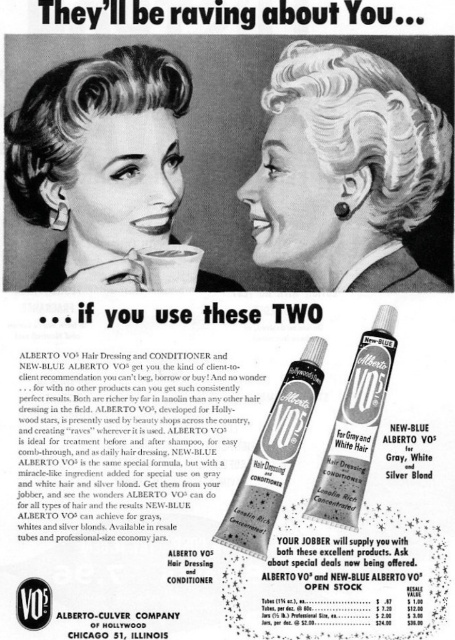
You are a hair stylist observing this vintage advertisement. You need to place a small decorative ribbon between the sleek blonde hair at center and the silver metallic hair conditioner at center. Given that the ribbon is 12 inches long, will there be enough space to place it between them without overlapping either object?

The distance between the sleek blonde hair at center and the silver metallic hair conditioner at center is 21.63 inches. Since the ribbon is only 12 inches long, there is sufficient space to place it between them without overlapping either object.

You are standing 1 meter away from the advertisement. There is a point at coordinates point (439,186). Can you reach that point without moving closer to the advertisement?

The distance of point (439,186) is 1.16 meters from the viewer, so you are currently 1 meter away. Since 1.16 meters is farther than 1 meter, you cannot reach that point without moving closer to the advertisement.

You are a stylist analyzing the vintage advertisement. You notice the sleek blonde hair at center and the matte black tube at center. Which object has a greater width?

The sleek blonde hair at center has a greater width than the matte black tube at center.